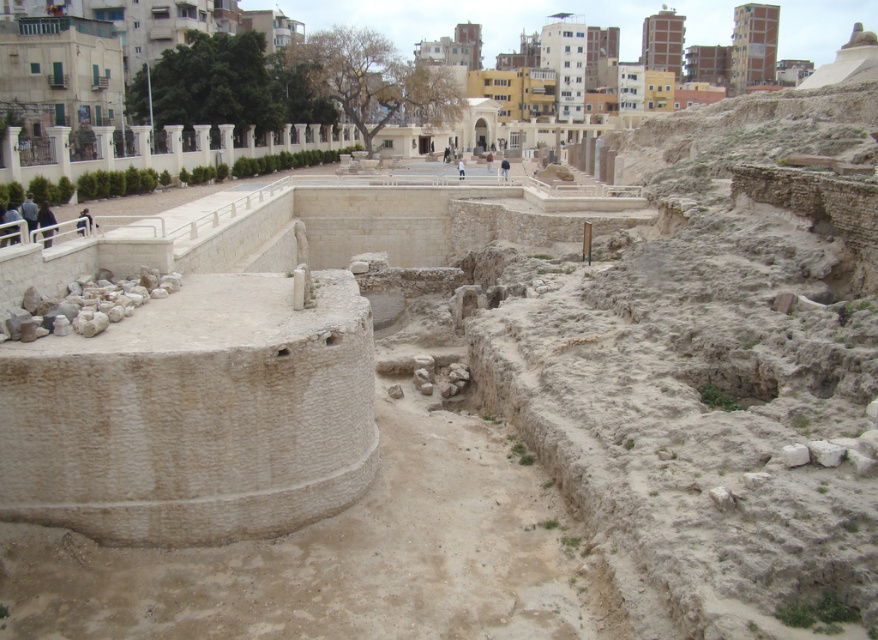
Question: Does light brown leather jacket at center have a smaller size compared to light blue fabric at center?

Choices:
 (A) no
 (B) yes

Answer: (A)

Question: Is dark blue fabric jacket at upper left smaller than light brown leather jacket at center?

Choices:
 (A) no
 (B) yes

Answer: (B)

Question: Which point appears farthest from the camera in this image?

Choices:
 (A) 461,170
 (B) 78,225

Answer: (A)

Question: Observing the image, what is the correct spatial positioning of light brown leather jacket at center in reference to light blue fabric at center?

Choices:
 (A) right
 (B) left

Answer: (A)

Question: Estimate the real-world distances between objects in this image. Which object is closer to the dark blue fabric jacket at upper left?

Choices:
 (A) light brown leather jacket at center
 (B) light blue fabric at center

Answer: (A)

Question: Which object appears closest to the camera in this image?

Choices:
 (A) dark blue fabric jacket at upper left
 (B) light brown leather jacket at center

Answer: (A)